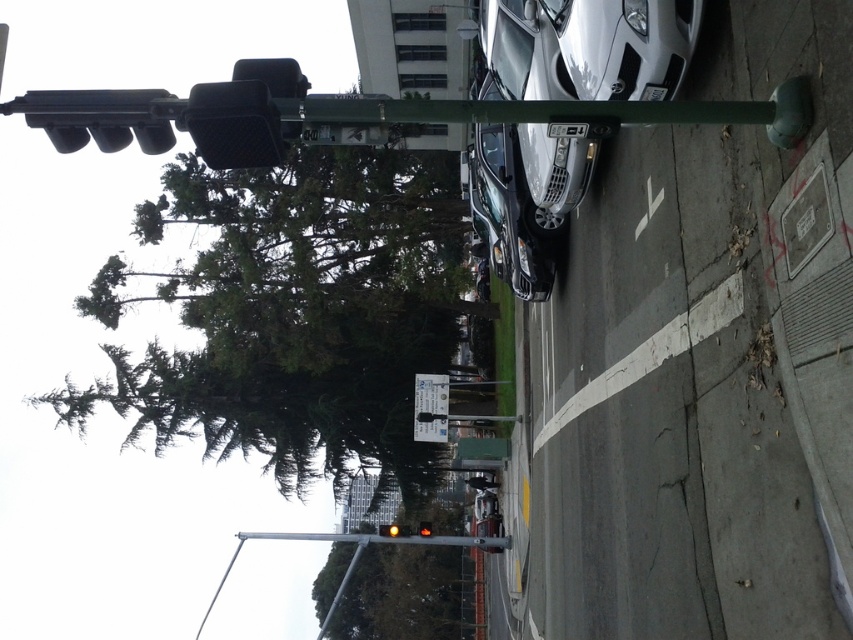
Is point (352, 596) closer to camera compared to point (407, 531)?

No, (352, 596) is further to viewer.

Can you confirm if green leafy tree at center is wider than yellow glass traffic light at center?

Yes, green leafy tree at center is wider than yellow glass traffic light at center.

Which is in front, point (425, 625) or point (393, 534)?

Point (393, 534)

Locate an element on the screen. The height and width of the screenshot is (640, 853). green leafy tree at center is located at coordinates (401, 595).

Is yellow glass traffic light at center wider than amber glass traffic light at upper center?

Correct, the width of yellow glass traffic light at center exceeds that of amber glass traffic light at upper center.

This screenshot has width=853, height=640. In order to click on yellow glass traffic light at center in this screenshot , I will do `click(393, 531)`.

Where is `yellow glass traffic light at center`? yellow glass traffic light at center is located at coordinates (393, 531).

Does green matte tree at upper left appear under satin silver car at center?

Correct, green matte tree at upper left is located below satin silver car at center.

Can you confirm if green matte tree at upper left is thinner than satin silver car at center?

No, green matte tree at upper left is not thinner than satin silver car at center.

This screenshot has height=640, width=853. I want to click on green matte tree at upper left, so click(x=294, y=314).

At what (x,y) coordinates should I click in order to perform the action: click on green matte tree at upper left. Please return your answer as a coordinate pair (x, y). Looking at the image, I should click on (294, 314).